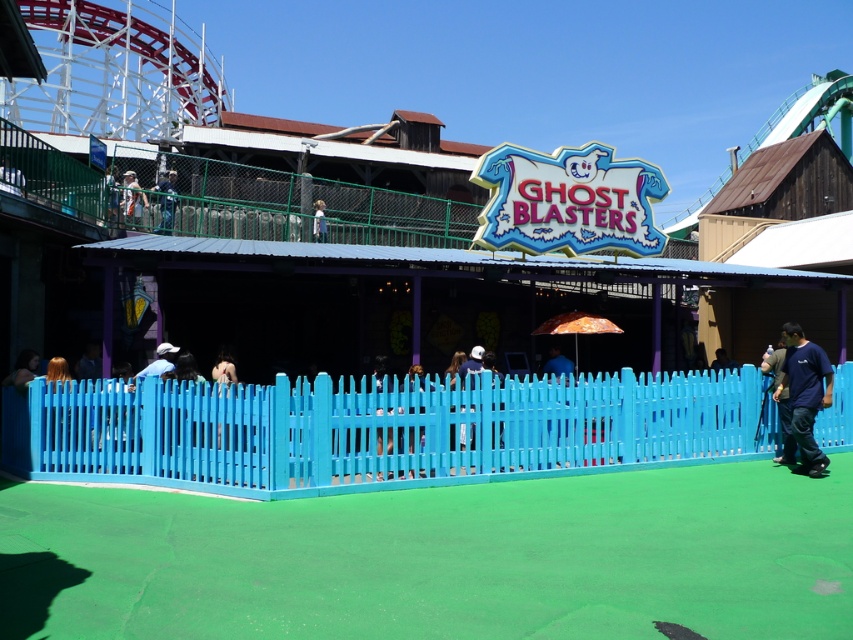
Question: Is bright blue painted wood fence at center behind blue fabric shirt at upper center?

Choices:
 (A) yes
 (B) no

Answer: (B)

Question: Can you confirm if blue fabric shirt at upper center is positioned below tan fabric shirt at upper left?

Choices:
 (A) no
 (B) yes

Answer: (A)

Question: Among these points, which one is farthest from the camera?

Choices:
 (A) (173, 196)
 (B) (312, 236)
 (C) (706, 452)
 (D) (131, 216)

Answer: (B)

Question: Which point is closer to the camera taking this photo?

Choices:
 (A) (170, 195)
 (B) (804, 358)
 (C) (321, 228)
 (D) (141, 208)

Answer: (B)

Question: Considering the real-world distances, which object is farthest from the blue fabric shirt at upper center?

Choices:
 (A) bright blue painted wood fence at center
 (B) tan fabric shirt at upper left
 (C) dark blue t-shirt at lower right
 (D) white fabric at upper center

Answer: (C)

Question: Where is bright blue painted wood fence at center located in relation to dark blue t-shirt at lower right in the image?

Choices:
 (A) right
 (B) left

Answer: (B)